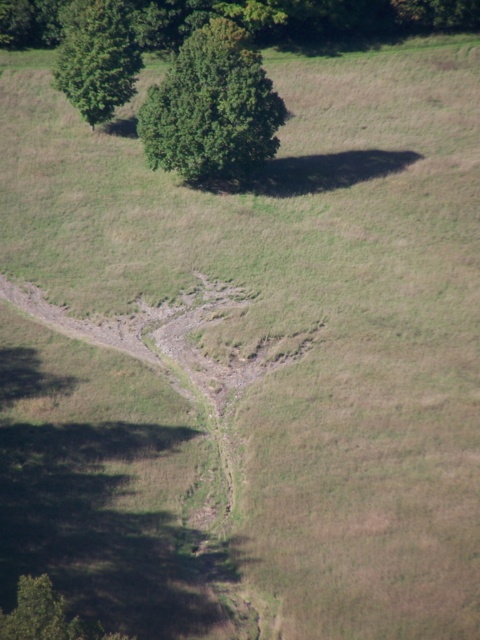
Does green matte tree at upper center have a greater width compared to green leafy tree at upper left?

Yes.

The height and width of the screenshot is (640, 480). Identify the location of green matte tree at upper center. (212, 109).

The width and height of the screenshot is (480, 640). I want to click on green matte tree at upper center, so click(x=212, y=109).

The image size is (480, 640). I want to click on green matte tree at upper center, so click(212, 109).